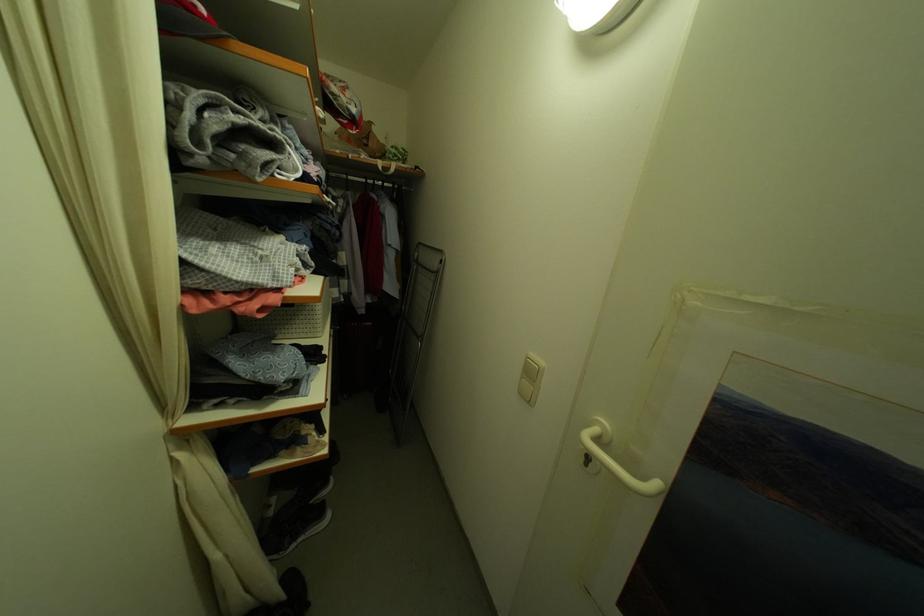
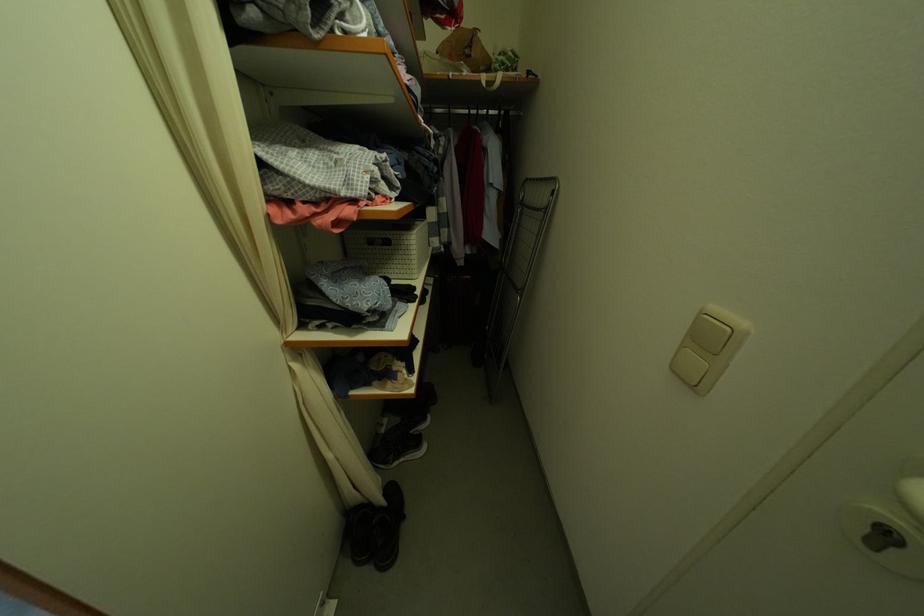
In the second image, find the point that corresponds to (x=593, y=460) in the first image.

(893, 537)